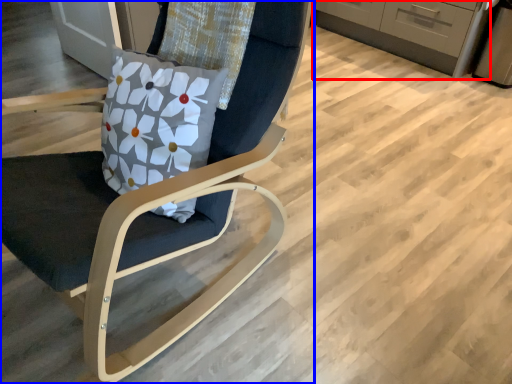
Question: Which object is closer to the camera taking this photo, cabinetry (highlighted by a red box) or chair (highlighted by a blue box)?

Choices:
 (A) cabinetry
 (B) chair

Answer: (B)